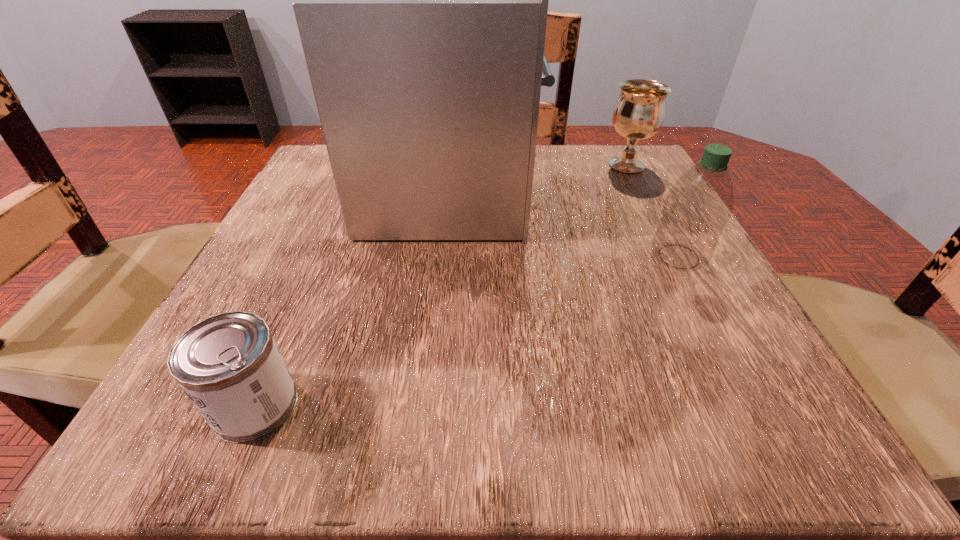
I want to click on the tallest object, so click(x=421, y=2).

Where is `water bottle`? water bottle is located at coordinates (697, 207).

Identify the location of chalice. (638, 114).

This screenshot has height=540, width=960. Identify the location of can. 229,365.

The height and width of the screenshot is (540, 960). I want to click on the shortest object, so click(229, 365).

Find the location of `vacant space positioned 0.190m on the front panel of the toaster oven`. vacant space positioned 0.190m on the front panel of the toaster oven is located at coordinates (627, 187).

Image resolution: width=960 pixels, height=540 pixels. In order to click on blank space located on the front of the water bottle in this screenshot , I will do `click(755, 401)`.

I want to click on vacant space situated on the front of the chalice, so click(x=648, y=206).

This screenshot has height=540, width=960. In order to click on vacant space located 0.340m on the back of the nearest object in this screenshot , I will do `click(336, 216)`.

The width and height of the screenshot is (960, 540). I want to click on toaster oven present at the far edge, so click(421, 2).